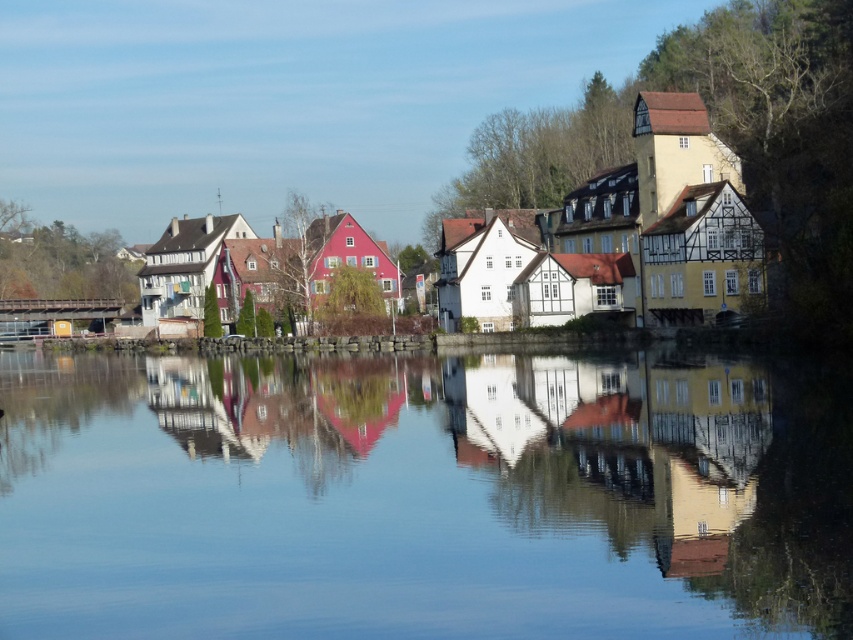
Question: Where is transparent glass water at center located in relation to wooden houses at center in the image?

Choices:
 (A) below
 (B) above

Answer: (A)

Question: Is transparent glass water at center to the right of wooden houses at center from the viewer's perspective?

Choices:
 (A) yes
 (B) no

Answer: (A)

Question: Can you confirm if transparent glass water at center is thinner than wooden houses at center?

Choices:
 (A) no
 (B) yes

Answer: (B)

Question: Among these objects, which one is nearest to the camera?

Choices:
 (A) transparent glass water at center
 (B) wooden houses at center

Answer: (A)